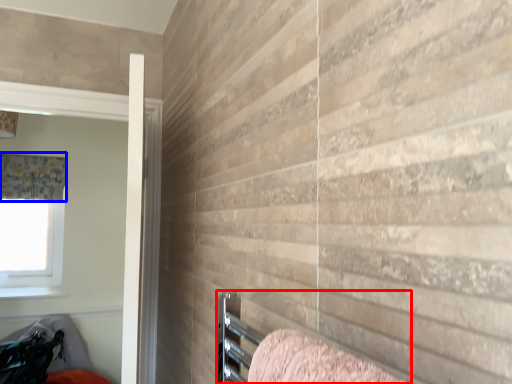
Question: Which point is closer to the camera, bed (highlighted by a red box) or curtain (highlighted by a blue box)?

Choices:
 (A) bed
 (B) curtain

Answer: (A)